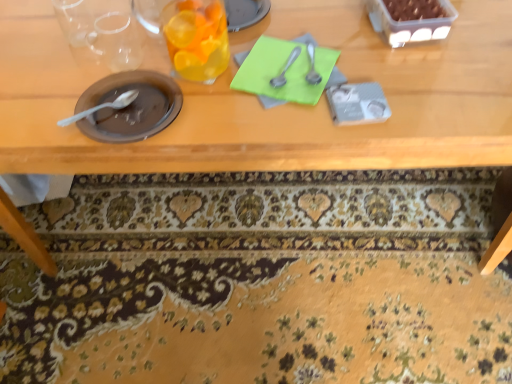
Identify the location of vacant space that's between matte brown plate at left, the first tableware viewed from the left, and translucent glass at upper center, the second tableware when ordered from left to right. (168, 87).